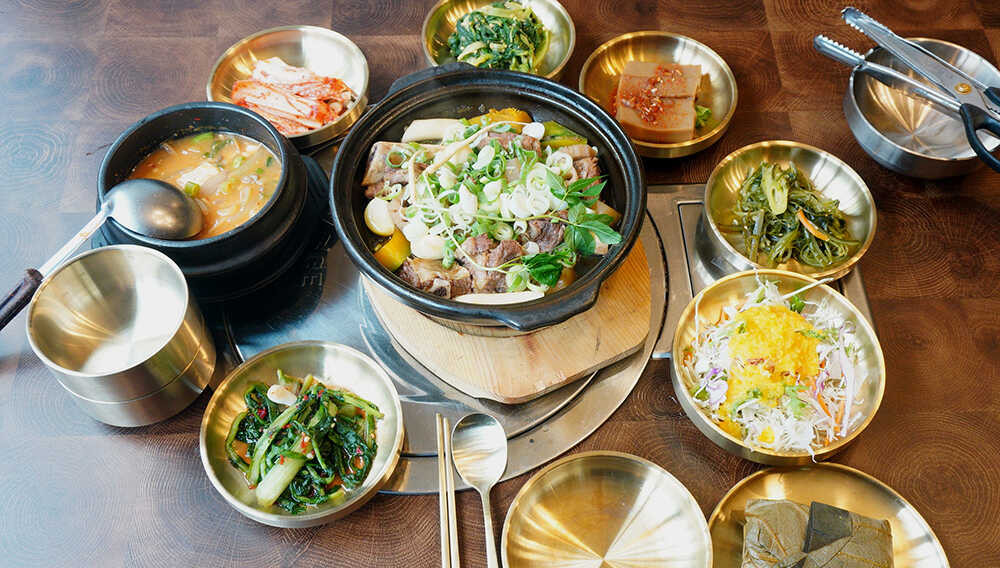
The width and height of the screenshot is (1000, 568). What are the coordinates of `wooden board` in the screenshot? It's located at (x=530, y=363).